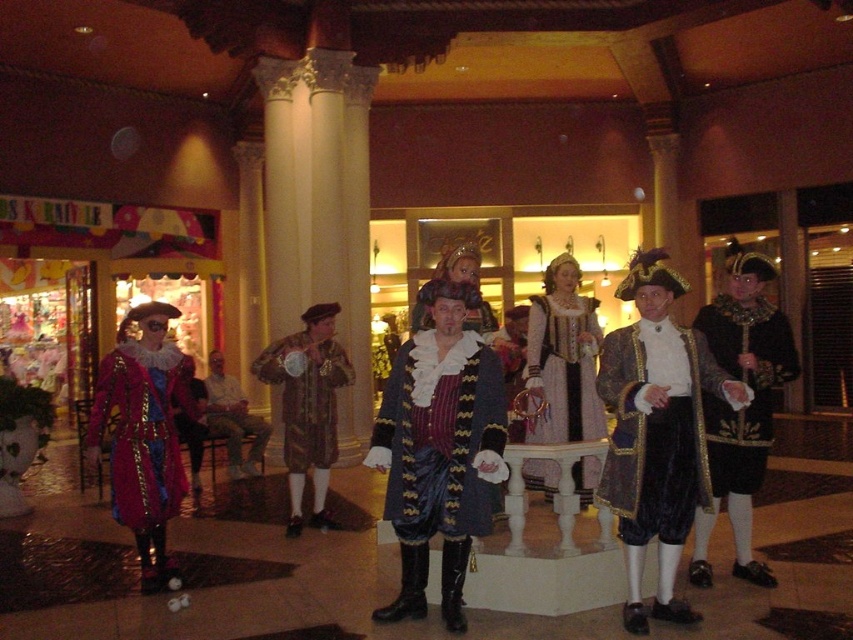
Question: Considering the relative positions of white satin dress at center and brown velvet coat at center in the image provided, where is white satin dress at center located with respect to brown velvet coat at center?

Choices:
 (A) below
 (B) above

Answer: (B)

Question: Is brown velvet coat at center smaller than light brown leather jacket at center?

Choices:
 (A) no
 (B) yes

Answer: (B)

Question: Can you confirm if gold brocade robe at center is positioned below white satin dress at center?

Choices:
 (A) yes
 (B) no

Answer: (B)

Question: Among these points, which one is nearest to the camera?

Choices:
 (A) pos(270,384)
 (B) pos(160,499)
 (C) pos(427,426)

Answer: (C)

Question: Which is nearer to the gold brocade robe at center?

Choices:
 (A) satin blue coat at center
 (B) white satin dress at center
 (C) light brown leather jacket at center
 (D) velvet/gold-trimmed coat at center

Answer: (D)

Question: Which point is farther to the camera?

Choices:
 (A) (576, 406)
 (B) (628, 416)
 (C) (473, 362)

Answer: (A)